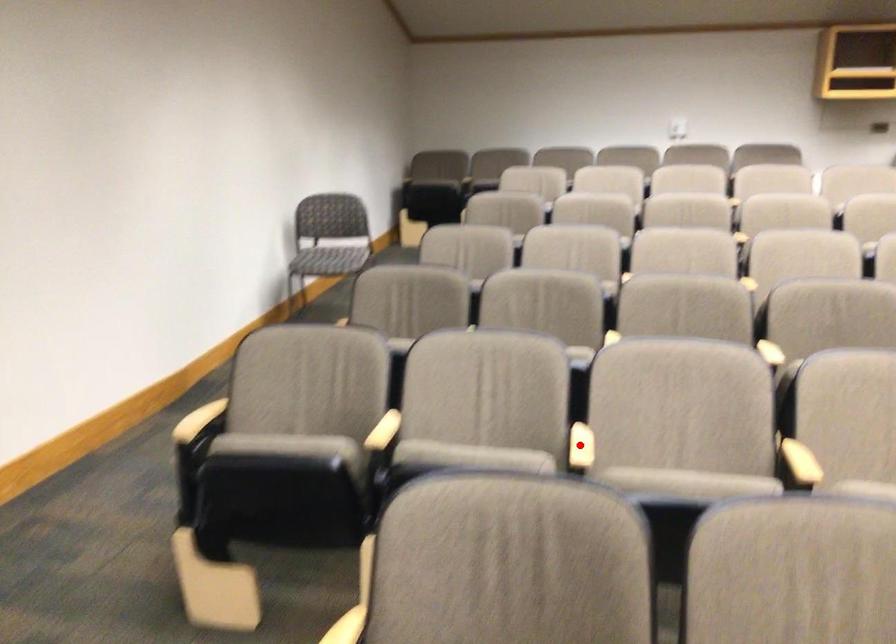
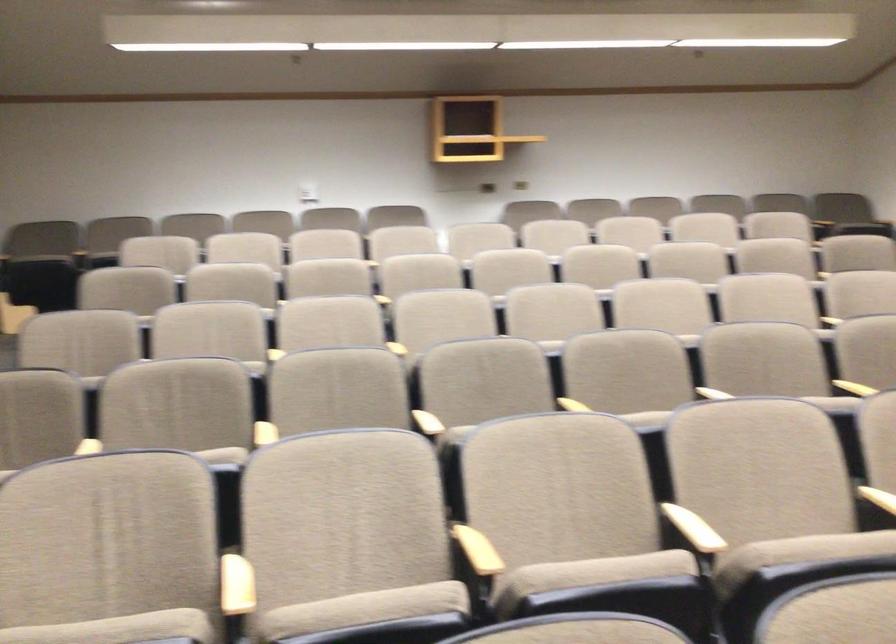
Question: I am providing you with two images of the same scene from different viewpoints. A red point is shown in image1. For the corresponding object point in image2, is it positioned nearer or farther from the camera?

Choices:
 (A) Nearer
 (B) Farther

Answer: (A)